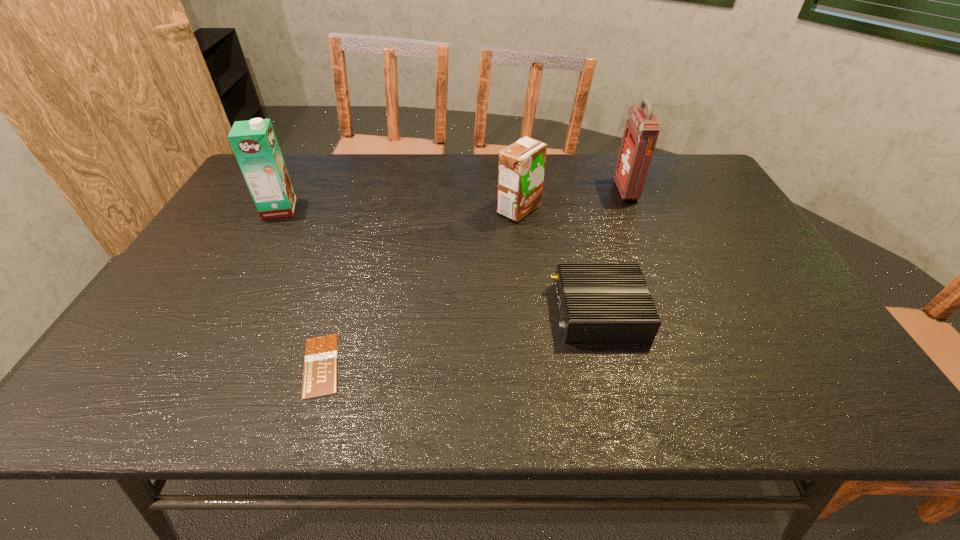
The image size is (960, 540). Find the location of `free space that satisfies the following two spatial constraints: 1. on the front side of the taller carton; 2. on the right side of the second object from left to right`. free space that satisfies the following two spatial constraints: 1. on the front side of the taller carton; 2. on the right side of the second object from left to right is located at coordinates (192, 365).